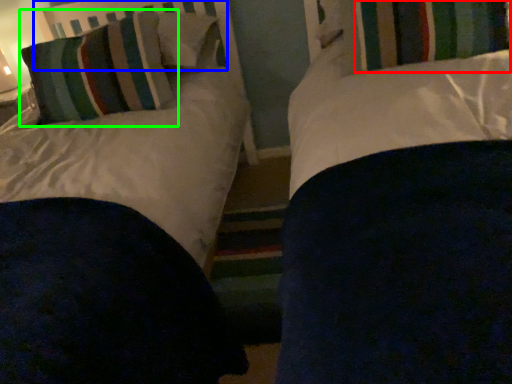
Question: Which object is positioned farthest from curtain (highlighted by a red box)? Select from headboard (highlighted by a blue box) and pillow (highlighted by a green box).

Choices:
 (A) headboard
 (B) pillow

Answer: (A)